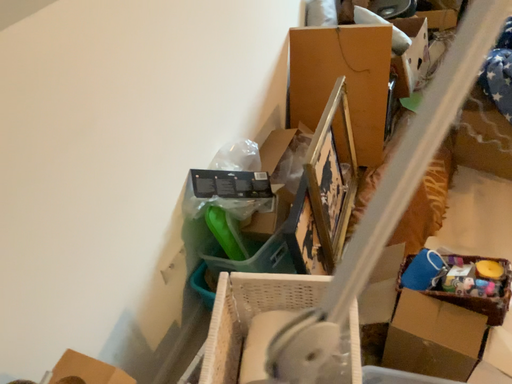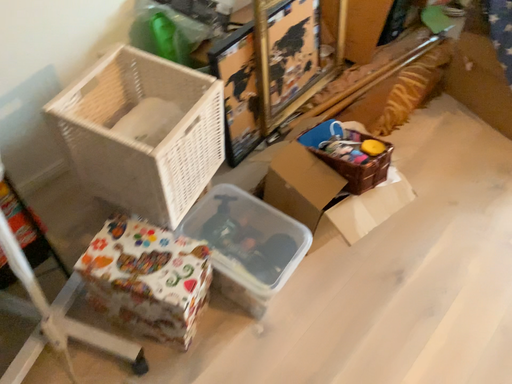
Question: How did the camera likely rotate when shooting the video?

Choices:
 (A) rotated right
 (B) rotated left

Answer: (B)